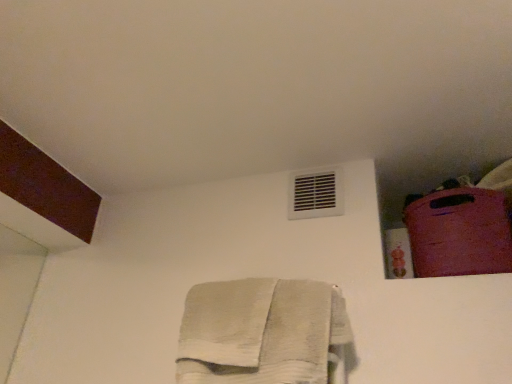
Question: Is white cotton towel at center shorter than white plastic air conditioning at upper center?

Choices:
 (A) no
 (B) yes

Answer: (A)

Question: From a real-world perspective, does white cotton towel at center sit lower than white plastic air conditioning at upper center?

Choices:
 (A) yes
 (B) no

Answer: (A)

Question: Is white cotton towel at center positioned behind white plastic air conditioning at upper center?

Choices:
 (A) no
 (B) yes

Answer: (A)

Question: Can you confirm if white cotton towel at center is positioned to the left of white plastic air conditioning at upper center?

Choices:
 (A) yes
 (B) no

Answer: (A)

Question: Is white cotton towel at center looking in the opposite direction of white plastic air conditioning at upper center?

Choices:
 (A) no
 (B) yes

Answer: (A)

Question: Is white plastic air conditioning at upper center in front of or behind rubberized pink suitcase at upper right in the image?

Choices:
 (A) behind
 (B) front

Answer: (A)

Question: Choose the correct answer: Is white plastic air conditioning at upper center inside rubberized pink suitcase at upper right or outside it?

Choices:
 (A) inside
 (B) outside

Answer: (B)

Question: Would you say white plastic air conditioning at upper center is to the left or to the right of rubberized pink suitcase at upper right in the picture?

Choices:
 (A) left
 (B) right

Answer: (A)

Question: From the image's perspective, is white plastic air conditioning at upper center located above or below rubberized pink suitcase at upper right?

Choices:
 (A) above
 (B) below

Answer: (A)

Question: Does point (481, 220) appear closer or farther from the camera than point (333, 190)?

Choices:
 (A) farther
 (B) closer

Answer: (B)

Question: In terms of size, does rubberized pink suitcase at upper right appear bigger or smaller than white plastic air conditioning at upper center?

Choices:
 (A) big
 (B) small

Answer: (A)

Question: Is rubberized pink suitcase at upper right situated inside white plastic air conditioning at upper center or outside?

Choices:
 (A) outside
 (B) inside

Answer: (A)

Question: Considering the positions of rubberized pink suitcase at upper right and white plastic air conditioning at upper center in the image, is rubberized pink suitcase at upper right taller or shorter than white plastic air conditioning at upper center?

Choices:
 (A) short
 (B) tall

Answer: (B)

Question: From the image's perspective, is white plastic air conditioning at upper center positioned above or below white cotton towel at center?

Choices:
 (A) below
 (B) above

Answer: (B)

Question: Is white plastic air conditioning at upper center inside the boundaries of white cotton towel at center, or outside?

Choices:
 (A) inside
 (B) outside

Answer: (B)